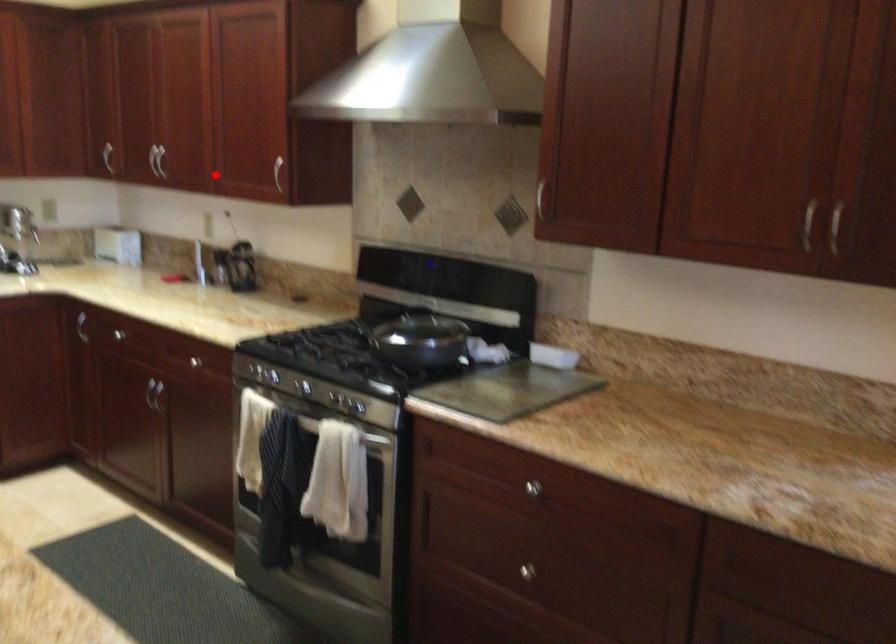
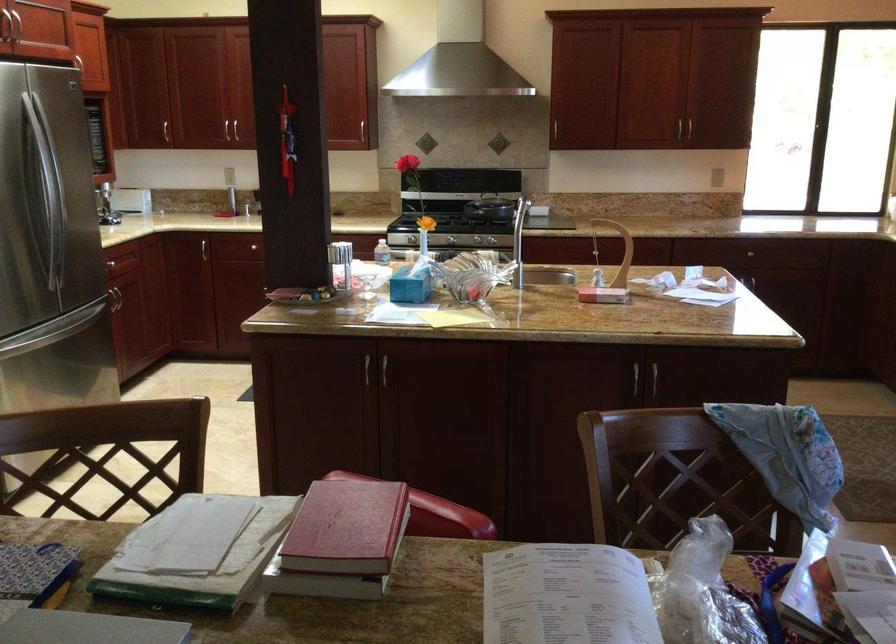
Question: I am providing you with two images of the same scene from different viewpoints. Given a red point in image1, look at the same physical point in image2. Is it:

Choices:
 (A) Closer to the viewpoint
 (B) Farther from the viewpoint

Answer: (B)